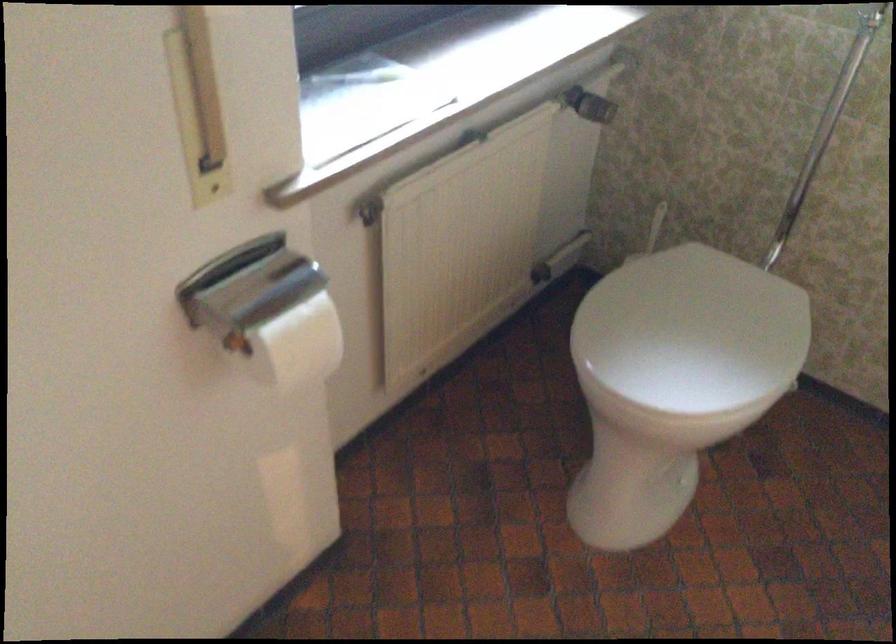
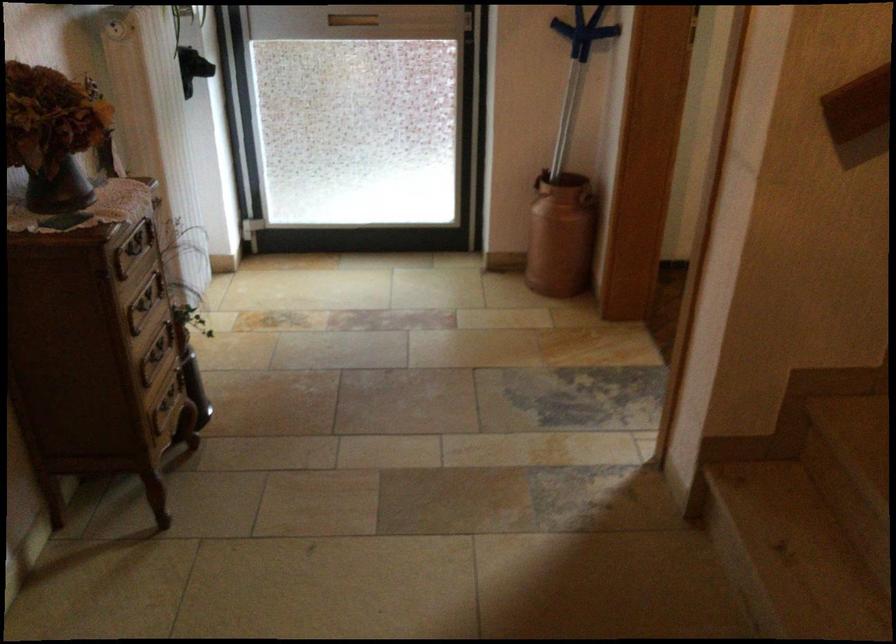
Question: I am providing you with two images of the same scene from different viewpoints. After the viewpoint changes to image2, which objects are now occluded?

Choices:
 (A) dark vase
 (B) toilet paper roll
 (C) drawer handle
 (D) translucent plastic bottle

Answer: (B)